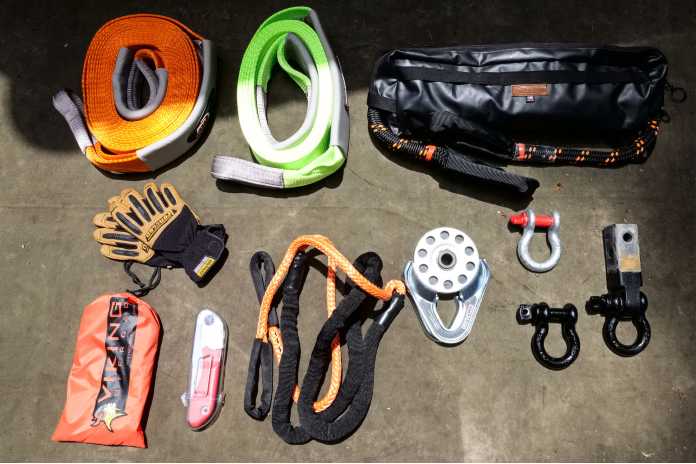
You are a GUI agent. You are given a task and a screenshot of the screen. Output one action in this format:
    pyautogui.click(x=<x>, y=<y>)
    Task: Click on the hook
    This screenshot has height=464, width=696.
    Given the screenshot: What is the action you would take?
    pyautogui.click(x=575, y=342)